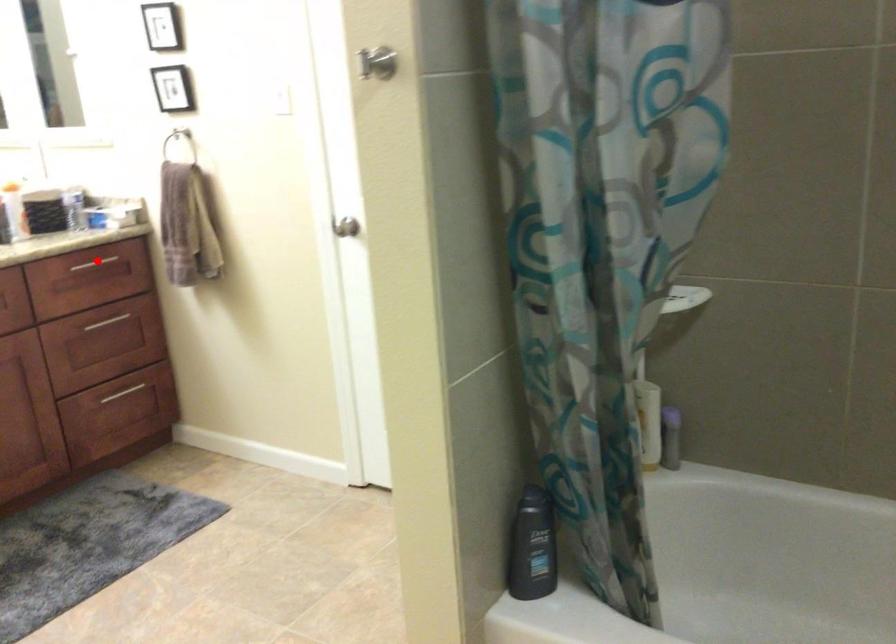
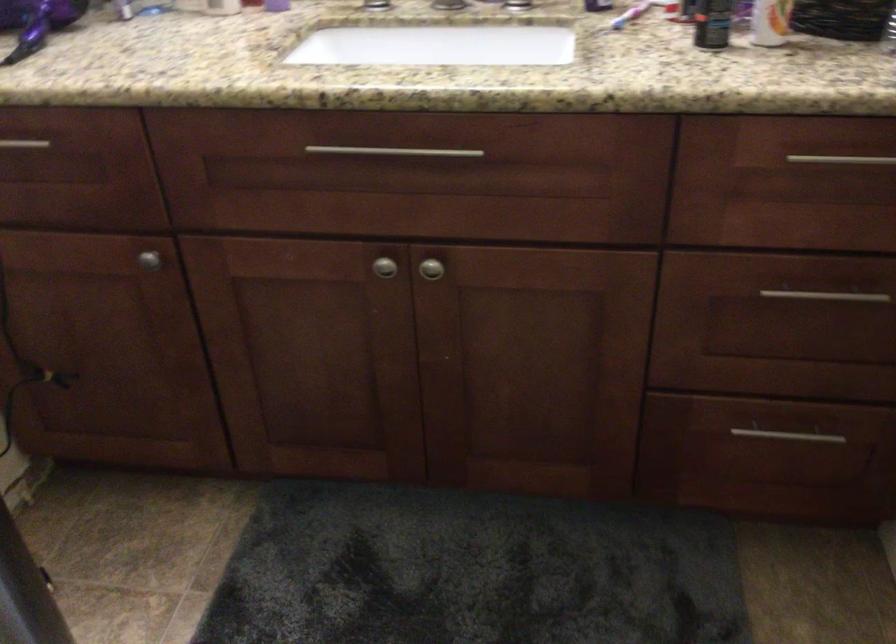
Question: I am providing you with two images of the same scene from different viewpoints. Image1 has a red point marked. In image2, the corresponding 3D location appears at what relative position? Reply with the corresponding letter.

Choices:
 (A) Closer
 (B) Farther

Answer: (A)